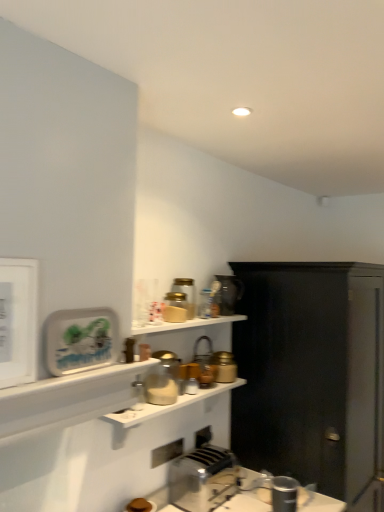
This screenshot has height=512, width=384. Identify the location of silver metallic toaster at lower center. (x=203, y=479).

Find the location of `matte white shelf at lower left, arranged as the first shelf when viewed from the top`. matte white shelf at lower left, arranged as the first shelf when viewed from the top is located at coordinates (68, 398).

Image resolution: width=384 pixels, height=512 pixels. What do you see at coordinates (177, 307) in the screenshot?
I see `matte glass jar at upper center, acting as the 5th appliance starting from the bottom` at bounding box center [177, 307].

At what (x,y) coordinates should I click in order to perform the action: click on matte glass jar at center, which appears as the 2th shelf when viewed from the front. Please return your answer as a coordinate pair (x, y). This screenshot has height=512, width=384. Looking at the image, I should click on (168, 405).

What do you see at coordinates (312, 376) in the screenshot?
I see `black matte cabinet at right` at bounding box center [312, 376].

The width and height of the screenshot is (384, 512). What are the coordinates of `matte gold jar at center, marked as the 6th appliance in a top-to-bottom arrangement` in the screenshot? It's located at (224, 366).

Locate an element on the screen. The height and width of the screenshot is (512, 384). silver metallic toaster at lower center is located at coordinates (203, 479).

Would you consider silver metallic toaster at lower center to be distant from matte glass jar at center, arranged as the 1th shelf when viewed from the back?

No, silver metallic toaster at lower center is in close proximity to matte glass jar at center, arranged as the 1th shelf when viewed from the back.

Considering the sizes of objects silver metallic toaster at lower center and matte glass jar at center, which appears as the first shelf when ordered from the bottom, in the image provided, who is taller, silver metallic toaster at lower center or matte glass jar at center, which appears as the first shelf when ordered from the bottom,?

silver metallic toaster at lower center is taller.

Could you tell me if silver metallic toaster at lower center is turned towards matte glass jar at center, positioned as the second shelf in top-to-bottom order?

No, silver metallic toaster at lower center is not oriented towards matte glass jar at center, positioned as the second shelf in top-to-bottom order.

Would you say silver metallic toaster at lower center is outside matte glass jar at center, which appears as the 2th shelf when viewed from the front?

Yes, silver metallic toaster at lower center is not within matte glass jar at center, which appears as the 2th shelf when viewed from the front.

The width and height of the screenshot is (384, 512). I want to click on cabinetry behind the matte glass jar at center, arranged as the 1th shelf when viewed from the back, so (x=312, y=376).

Based on their sizes in the image, would you say matte glass jar at center, which appears as the first shelf when ordered from the bottom, is bigger or smaller than black matte cabinet at right?

matte glass jar at center, which appears as the first shelf when ordered from the bottom, is smaller than black matte cabinet at right.

Are matte glass jar at center, positioned as the second shelf in top-to-bottom order, and black matte cabinet at right located far from each other?

No, matte glass jar at center, positioned as the second shelf in top-to-bottom order, is in close proximity to black matte cabinet at right.

Which is farther, (x=202, y=389) or (x=245, y=432)?

The point (x=245, y=432) is farther from the camera.

Consider the image. Is matte glass jar at center, which appears as the first shelf when ordered from the bottom, directly adjacent to matte white shelf at lower left, the first shelf from the front?

No, matte glass jar at center, which appears as the first shelf when ordered from the bottom, is not making contact with matte white shelf at lower left, the first shelf from the front.

From the picture: In terms of size, does matte glass jar at center, arranged as the 1th shelf when viewed from the back, appear bigger or smaller than matte white shelf at lower left, which appears as the second shelf when ordered from the bottom?

Considering their sizes, matte glass jar at center, arranged as the 1th shelf when viewed from the back, takes up more space than matte white shelf at lower left, which appears as the second shelf when ordered from the bottom.

From the image's perspective, would you say matte glass jar at center, arranged as the 1th shelf when viewed from the back, is positioned over matte white shelf at lower left, the first shelf from the front?

No, from the image's perspective, matte glass jar at center, arranged as the 1th shelf when viewed from the back, is not over matte white shelf at lower left, the first shelf from the front.

Considering the relative sizes of matte gold jar at center, marked as the 6th appliance in a top-to-bottom arrangement, and black matte cabinet at right in the image provided, is matte gold jar at center, marked as the 6th appliance in a top-to-bottom arrangement, smaller than black matte cabinet at right?

Yes.

Could you tell me if matte gold jar at center, marked as the 2th appliance in a back-to-front arrangement, is turned towards black matte cabinet at right?

No, matte gold jar at center, marked as the 2th appliance in a back-to-front arrangement, is not facing towards black matte cabinet at right.

Which object is more forward, matte gold jar at center, marked as the 6th appliance in a top-to-bottom arrangement, or black matte cabinet at right?

black matte cabinet at right is closer to the camera.

Is matte gold jar at center, marked as the 2th appliance in a back-to-front arrangement, located outside black matte cabinet at right?

Indeed, matte gold jar at center, marked as the 2th appliance in a back-to-front arrangement, is completely outside black matte cabinet at right.

From the picture: Does metallic silver toaster at upper center, placed as the first appliance when sorted from top to bottom, lie behind metallic silver toaster at lower center, marked as the 6th appliance in a back-to-front arrangement?

Yes, metallic silver toaster at upper center, placed as the first appliance when sorted from top to bottom, is further from the camera.

Is point (219, 291) positioned in front of point (271, 486)?

No, (219, 291) is further to viewer.

From a real-world perspective, is metallic silver toaster at upper center, the seventh appliance in the front-to-back sequence, above or below metallic silver toaster at lower center, acting as the first appliance starting from the bottom?

metallic silver toaster at upper center, the seventh appliance in the front-to-back sequence, is situated higher than metallic silver toaster at lower center, acting as the first appliance starting from the bottom, in the real world.

From the picture: Is metallic silver toaster at lower center, acting as the first appliance starting from the bottom, at the back of metallic silver toaster at upper center, which is the 7th appliance in bottom-to-top order?

That's not correct — metallic silver toaster at upper center, which is the 7th appliance in bottom-to-top order, is not looking away from metallic silver toaster at lower center, acting as the first appliance starting from the bottom.

Is point (274, 506) closer or farther from the camera than point (104, 416)?

Point (274, 506).

Is metallic silver toaster at lower center, which ranks as the seventh appliance in top-to-bottom order, in front of or behind matte glass jar at center, which appears as the first shelf when ordered from the bottom, in the image?

Clearly, metallic silver toaster at lower center, which ranks as the seventh appliance in top-to-bottom order, is behind matte glass jar at center, which appears as the first shelf when ordered from the bottom.

Is metallic silver toaster at lower center, which is the 2th appliance in front-to-back order, aimed at matte glass jar at center, arranged as the 1th shelf when viewed from the back?

No, metallic silver toaster at lower center, which is the 2th appliance in front-to-back order, is not facing towards matte glass jar at center, arranged as the 1th shelf when viewed from the back.

Considering the positions of objects matte glass jar at center, which appears as the 2th shelf when viewed from the front, and matte gold jar at center, marked as the 6th appliance in a top-to-bottom arrangement, in the image provided, who is more to the left, matte glass jar at center, which appears as the 2th shelf when viewed from the front, or matte gold jar at center, marked as the 6th appliance in a top-to-bottom arrangement,?

matte glass jar at center, which appears as the 2th shelf when viewed from the front.

Is matte glass jar at center, which appears as the first shelf when ordered from the bottom, next to matte gold jar at center, arranged as the second appliance when ordered from the bottom?

No, matte glass jar at center, which appears as the first shelf when ordered from the bottom, is not next to matte gold jar at center, arranged as the second appliance when ordered from the bottom.

Considering the relative sizes of matte glass jar at center, which appears as the 2th shelf when viewed from the front, and matte gold jar at center, positioned as the sixth appliance in front-to-back order, in the image provided, is matte glass jar at center, which appears as the 2th shelf when viewed from the front, bigger than matte gold jar at center, positioned as the sixth appliance in front-to-back order,?

Yes.

Measure the distance between matte glass jar at center, which appears as the first shelf when ordered from the bottom, and matte gold jar at center, positioned as the sixth appliance in front-to-back order.

matte glass jar at center, which appears as the first shelf when ordered from the bottom, is 24.98 centimeters from matte gold jar at center, positioned as the sixth appliance in front-to-back order.

This screenshot has height=512, width=384. What are the coordinates of `toaster that appears behind the matte glass jar at center, which appears as the first shelf when ordered from the bottom` in the screenshot? It's located at (203, 479).

From the image's perspective, starting from the black matte cabinet at right, which shelf is the 1st one above? Please provide its 2D coordinates.

[(168, 405)]

Based on their spatial positions, is matte white shelf at lower left, which appears as the second shelf when ordered from the bottom, or translucent glass jar at upper center, which is the 4th appliance in back-to-front order, further from metallic faucet at upper center, marked as the 5th appliance in a top-to-bottom arrangement?

The object further to metallic faucet at upper center, marked as the 5th appliance in a top-to-bottom arrangement, is matte white shelf at lower left, which appears as the second shelf when ordered from the bottom.

From the picture: Looking at the image, which one is located further to matte glass jar at center, arranged as the 1th shelf when viewed from the back, translucent glass jar at upper center, which is the 6th appliance in bottom-to-top order, or matte gold jar at center, arranged as the second appliance when ordered from the bottom?

Based on the image, translucent glass jar at upper center, which is the 6th appliance in bottom-to-top order, appears to be further to matte glass jar at center, arranged as the 1th shelf when viewed from the back.

Based on their spatial positions, is matte gold jar at center, positioned as the sixth appliance in front-to-back order, or matte glass jar at upper center, placed as the fifth appliance when sorted from back to front, closer to translucent glass jar at upper center, marked as the second appliance in a top-to-bottom arrangement?

→ matte glass jar at upper center, placed as the fifth appliance when sorted from back to front, lies closer to translucent glass jar at upper center, marked as the second appliance in a top-to-bottom arrangement, than the other object.

Based on their spatial positions, is silver metallic toaster at lower center or metallic silver toaster at upper center, the seventh appliance in the front-to-back sequence, closer to black matte cabinet at right?

Among the two, metallic silver toaster at upper center, the seventh appliance in the front-to-back sequence, is located nearer to black matte cabinet at right.

Estimate the real-world distances between objects in this image. Which object is closer to metallic silver toaster at upper center, which is the 7th appliance in bottom-to-top order, black matte cabinet at right or translucent glass jar at upper center, placed as the fourth appliance when sorted from front to back?

translucent glass jar at upper center, placed as the fourth appliance when sorted from front to back.

Estimate the real-world distances between objects in this image. Which object is closer to silver metallic toaster at lower center, metallic silver toaster at upper center, the seventh appliance in the front-to-back sequence, or matte glass jar at center, arranged as the 1th shelf when viewed from the back?

matte glass jar at center, arranged as the 1th shelf when viewed from the back, is positioned closer to the anchor silver metallic toaster at lower center.

Based on their spatial positions, is metallic faucet at upper center, the 3th appliance from the back, or metallic silver toaster at lower center, marked as the 6th appliance in a back-to-front arrangement, further from matte glass jar at center, which appears as the first shelf when ordered from the bottom?

Among the two, metallic silver toaster at lower center, marked as the 6th appliance in a back-to-front arrangement, is located further to matte glass jar at center, which appears as the first shelf when ordered from the bottom.

Considering their positions, is metallic silver toaster at upper center, which is the 7th appliance in bottom-to-top order, positioned further to silver metallic toaster at lower center than translucent glass jar at upper center, which is the 4th appliance in back-to-front order?

The object further to silver metallic toaster at lower center is translucent glass jar at upper center, which is the 4th appliance in back-to-front order.

Find the location of `toaster between matte white shelf at lower left, which is the second shelf from back to front, and metallic faucet at upper center, the 3th appliance from the back, from front to back`. toaster between matte white shelf at lower left, which is the second shelf from back to front, and metallic faucet at upper center, the 3th appliance from the back, from front to back is located at coordinates (203, 479).

This screenshot has width=384, height=512. In order to click on toaster positioned between matte white shelf at lower left, arranged as the first shelf when viewed from the top, and metallic silver toaster at upper center, the first appliance when ordered from back to front, from near to far in this screenshot , I will do `click(203, 479)`.

The height and width of the screenshot is (512, 384). What are the coordinates of `shelf between matte white shelf at lower left, the first shelf from the front, and metallic silver toaster at upper center, placed as the first appliance when sorted from top to bottom, in the front-back direction` in the screenshot? It's located at (168, 405).

At what (x,y) coordinates should I click in order to perform the action: click on toaster between matte white shelf at lower left, which is the second shelf from back to front, and translucent glass jar at upper center, which is the 6th appliance in bottom-to-top order, along the z-axis. Please return your answer as a coordinate pair (x, y). Looking at the image, I should click on (203, 479).